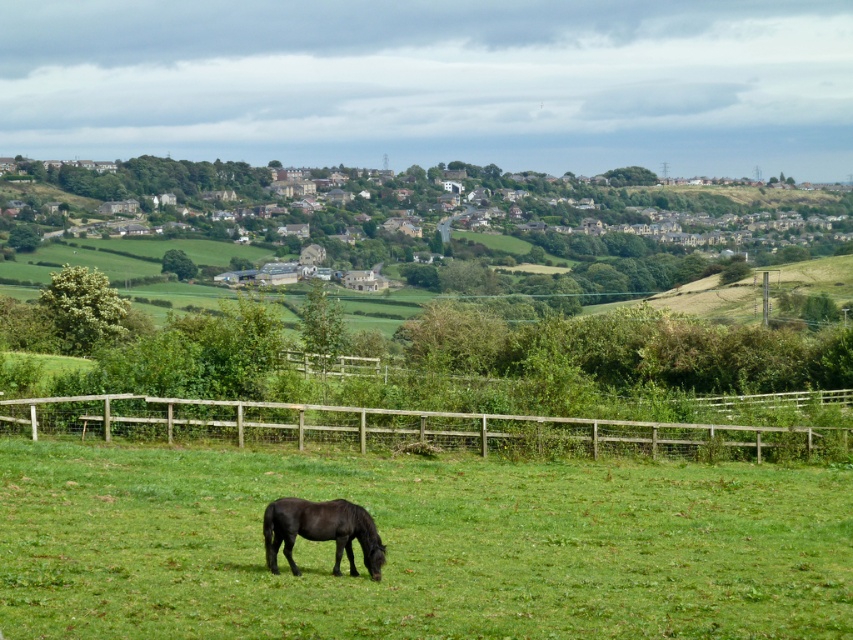
You are a photographer planning to capture a wide shot of the green grassy field at center and the black glossy horse at lower center. Given that the field is larger than the horse, how should you position your camera to ensure both are fully visible in the frame?

Since the green grassy field at center is bigger than the black glossy horse at lower center, position the camera to include the entire field while ensuring the horse is centered and not cropped. Use a wide angle lens to capture both elements in the scene.

You are standing at the edge of the brown wooden fence at lower center and looking towards the green grassy field at center. Which object is taller?

The brown wooden fence at lower center is taller than the green grassy field at center.

You are standing at the origin point of the image. There is a brown wooden fence at lower center located at point (405, 428). Can you confirm if the brown wooden fence at lower center is positioned exactly at the given coordinates?

Yes, the brown wooden fence at lower center is positioned exactly at point (405, 428) as stated in the description.